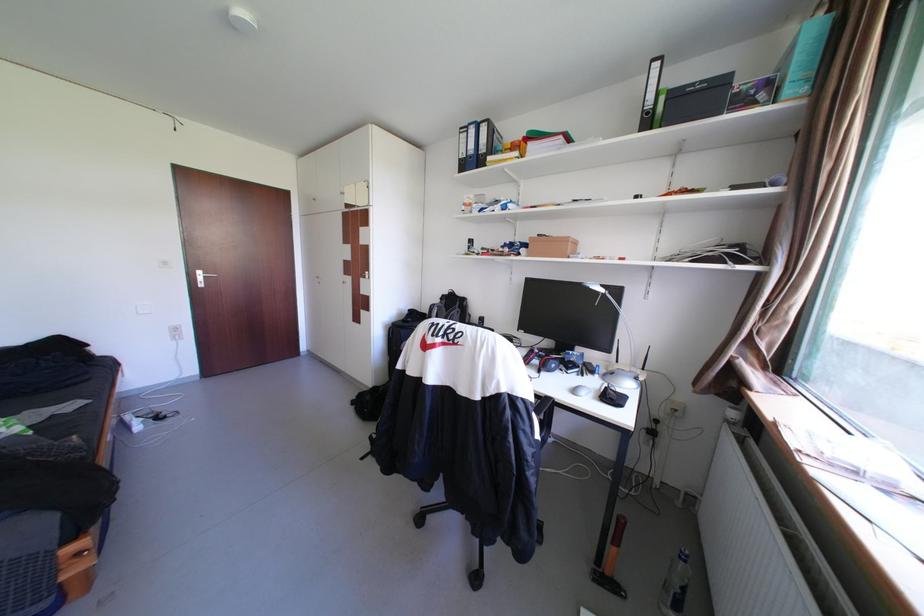
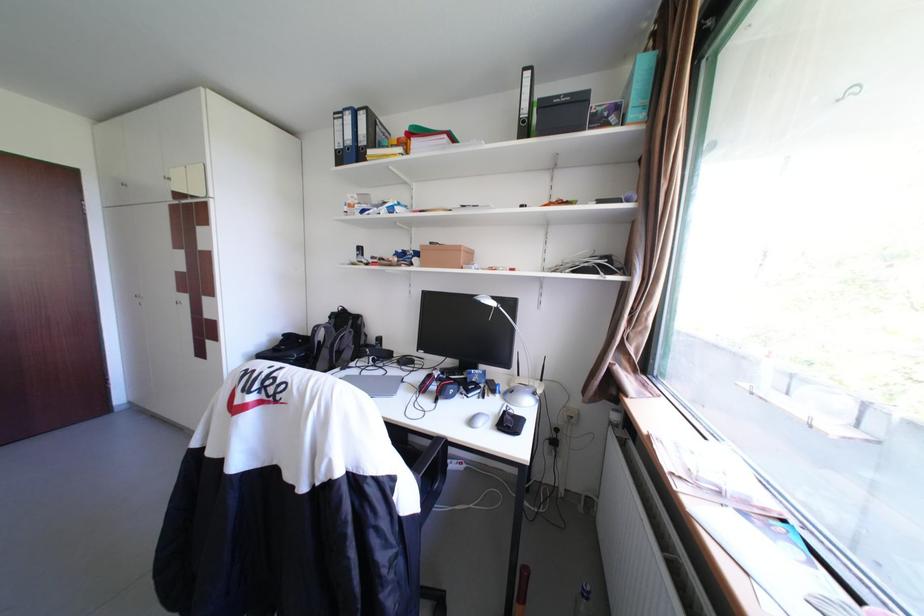
Where in the second image is the point corresponding to pixel 653 111 from the first image?

(530, 120)